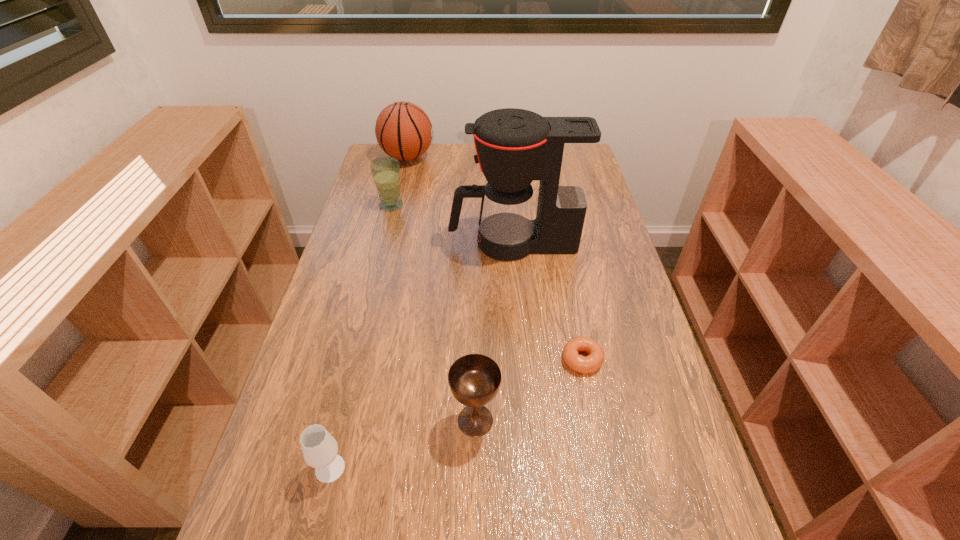
Locate an element on the screen. the third farthest object is located at coordinates (514, 146).

This screenshot has width=960, height=540. What are the coordinates of `coffee maker` in the screenshot? It's located at (514, 146).

At what (x,y) coordinates should I click in order to perform the action: click on the farthest object. Please return your answer as a coordinate pair (x, y). Looking at the image, I should click on (403, 130).

Locate an element on the screen. The image size is (960, 540). the second tallest object is located at coordinates pyautogui.click(x=403, y=130).

Where is `the fifth farthest object`? the fifth farthest object is located at coordinates 474,379.

The image size is (960, 540). I want to click on the fifth nearest object, so click(385, 171).

At what (x,y) coordinates should I click in order to perform the action: click on the farther glass. Please return your answer as a coordinate pair (x, y). The image size is (960, 540). Looking at the image, I should click on (385, 171).

This screenshot has height=540, width=960. Find the location of `the nearer glass`. the nearer glass is located at coordinates (319, 447).

Locate an element on the screen. the nearest object is located at coordinates (319, 447).

At what (x,y) coordinates should I click in order to perform the action: click on the fourth farthest object. Please return your answer as a coordinate pair (x, y). The height and width of the screenshot is (540, 960). Looking at the image, I should click on (591, 363).